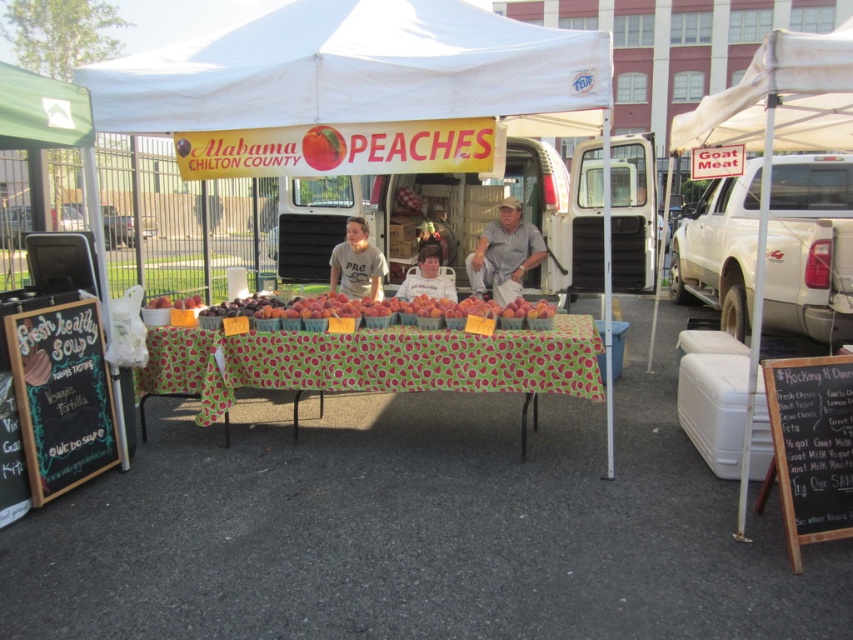
What is the spatial relationship between the green fabric tablecloth at center and the black chalkboard menu at lower right in terms of height?

The green fabric tablecloth at center is shorter than the black chalkboard menu at lower right.

What is the relationship between the size of the green fabric tablecloth at center and the black chalkboard menu at lower right?

The green fabric tablecloth at center is larger in size than the black chalkboard menu at lower right.

Based on the scene description provided, where is the white fabric tent at center located in terms of coordinates?

The white fabric tent at center is located at point coordinates of [354,68].